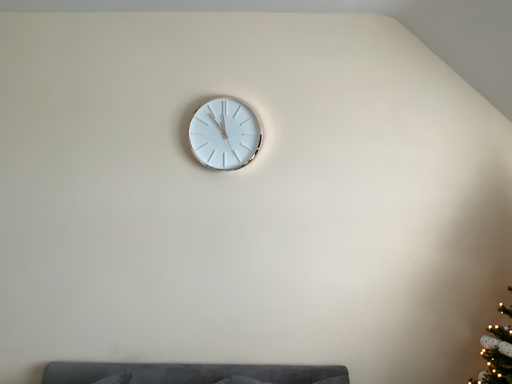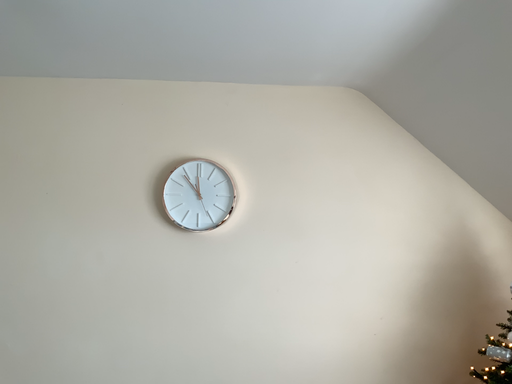
Question: Which way did the camera rotate in the video?

Choices:
 (A) rotated downward
 (B) rotated upward

Answer: (B)